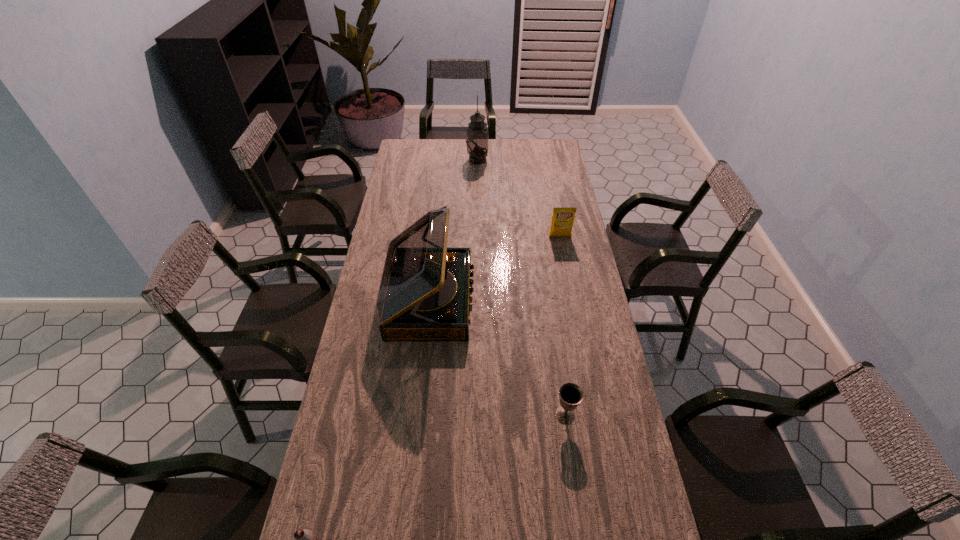
Find the location of `free region located on the front of the second farthest object with the logo`. free region located on the front of the second farthest object with the logo is located at coordinates (570, 288).

This screenshot has width=960, height=540. In order to click on vacant space located on the left of the fourth farthest object in this screenshot , I will do `click(447, 416)`.

This screenshot has width=960, height=540. I want to click on object that is at the far edge, so (477, 133).

What are the coordinates of `object located at the left edge` in the screenshot? It's located at (424, 292).

Find the location of a particular element. This screenshot has width=960, height=540. crisp (potato chip) at the right edge is located at coordinates (562, 222).

Locate an element on the screen. Image resolution: width=960 pixels, height=540 pixels. chalice situated at the right edge is located at coordinates (570, 395).

I want to click on free space at the far edge of the desktop, so click(x=498, y=146).

Where is `vacant space at the left edge of the desktop`? The height and width of the screenshot is (540, 960). vacant space at the left edge of the desktop is located at coordinates pyautogui.click(x=385, y=255).

Locate an element on the screen. This screenshot has height=540, width=960. free space at the right edge of the desktop is located at coordinates (575, 254).

Locate an element on the screen. free space between the oil lamp and the fourth nearest object is located at coordinates (518, 198).